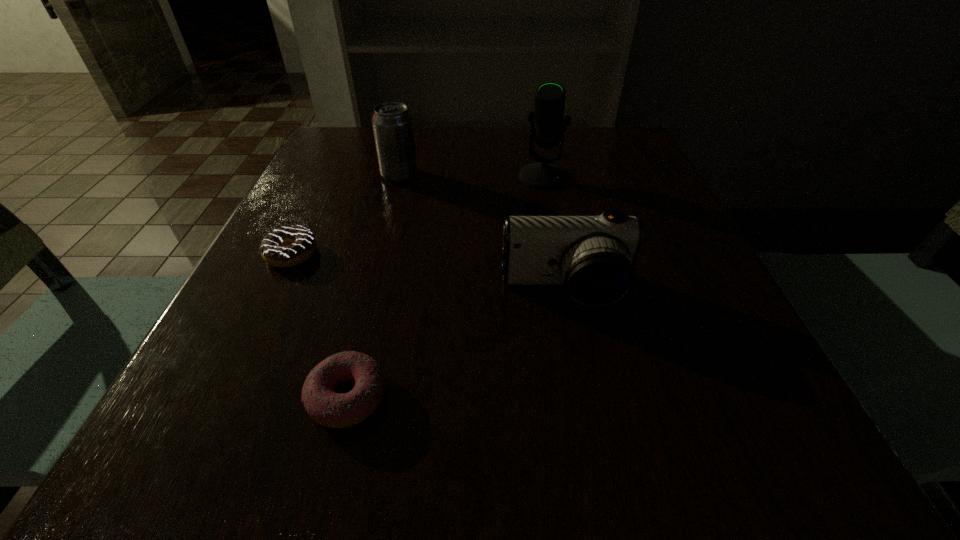
In the image, there is a desktop. Identify the location of vacant space at the right edge. The image size is (960, 540). (x=744, y=387).

Identify the location of vacant area at the far left corner. (349, 150).

The height and width of the screenshot is (540, 960). In the image, there is a desktop. In order to click on free region at the far right corner in this screenshot , I will do (x=626, y=130).

Where is `free space between the shortest object and the right doughnut`? The width and height of the screenshot is (960, 540). free space between the shortest object and the right doughnut is located at coordinates (320, 326).

Locate an element on the screen. This screenshot has width=960, height=540. vacant area between the soda can and the right doughnut is located at coordinates (373, 286).

What are the coordinates of `empty location between the camcorder and the left doughnut` in the screenshot? It's located at (428, 273).

The height and width of the screenshot is (540, 960). I want to click on vacant region between the microphone and the soda can, so click(x=471, y=176).

Locate an element on the screen. This screenshot has height=540, width=960. vacant area that lies between the microphone and the nearer doughnut is located at coordinates (445, 287).

This screenshot has width=960, height=540. What are the coordinates of `empty space between the nearer doughnut and the tallest object` in the screenshot? It's located at (445, 287).

Where is `vacant space that is in between the soda can and the camcorder`? Image resolution: width=960 pixels, height=540 pixels. vacant space that is in between the soda can and the camcorder is located at coordinates (482, 233).